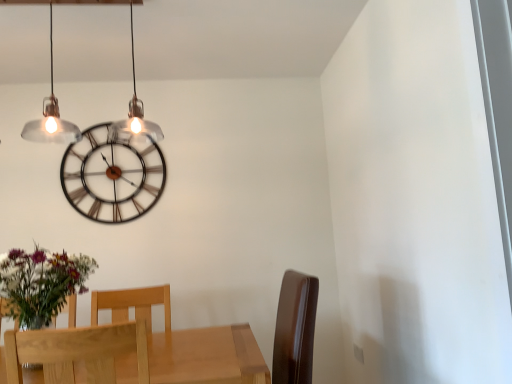
Question: Considering the positions of point (146, 140) and point (159, 297), is point (146, 140) closer or farther from the camera than point (159, 297)?

Choices:
 (A) closer
 (B) farther

Answer: (B)

Question: In terms of size, does metallic wire clock at upper center appear bigger or smaller than light wood chair at lower left, positioned as the 2th chair in front-to-back order?

Choices:
 (A) big
 (B) small

Answer: (B)

Question: Which object is the closest to the clear glass pendant lights at upper left?

Choices:
 (A) light wood chair at lower left, the first chair in the back-to-front sequence
 (B) metallic wire clock at upper center
 (C) light brown wood chair at lower left, acting as the first chair starting from the front

Answer: (B)

Question: Estimate the real-world distances between objects in this image. Which object is farther from the light wood chair at lower left, the first chair in the back-to-front sequence?

Choices:
 (A) light brown wood chair at lower left, acting as the first chair starting from the front
 (B) clear glass pendant lights at upper left
 (C) metallic wire clock at upper center

Answer: (B)